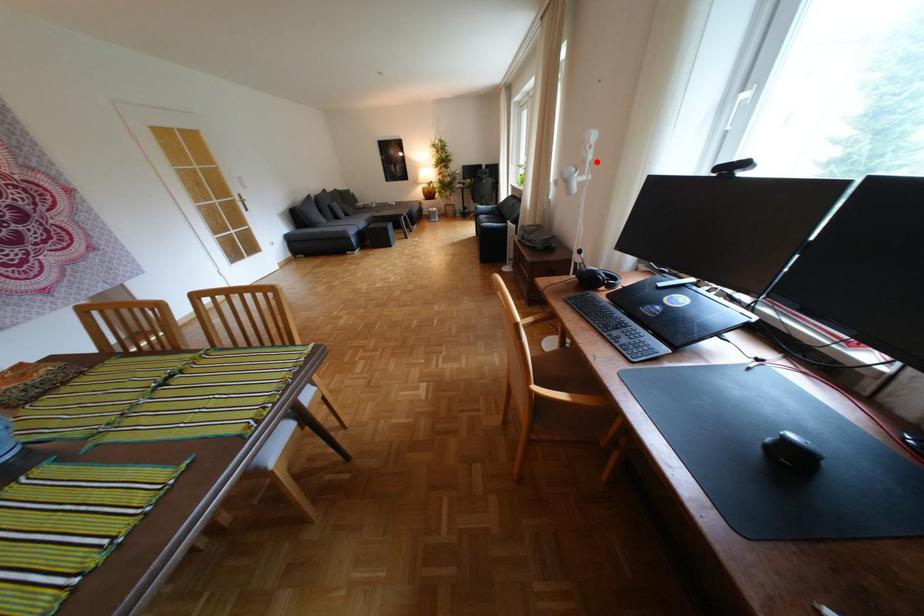
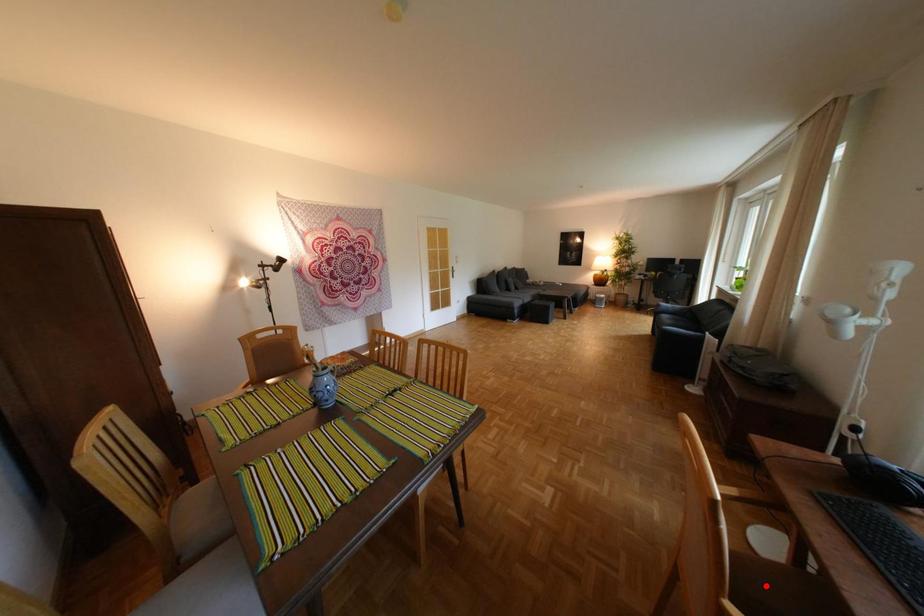
I am providing you with two images of the same scene from different viewpoints. A red point is marked on the first image and another point is marked on the second image. Does the point marked in image1 correspond to the same location as the one in image2?

No